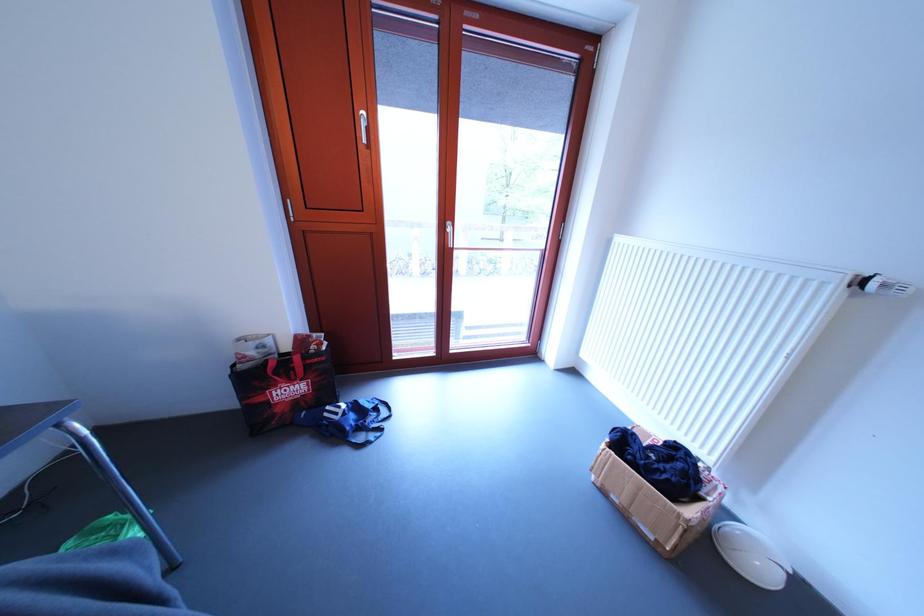
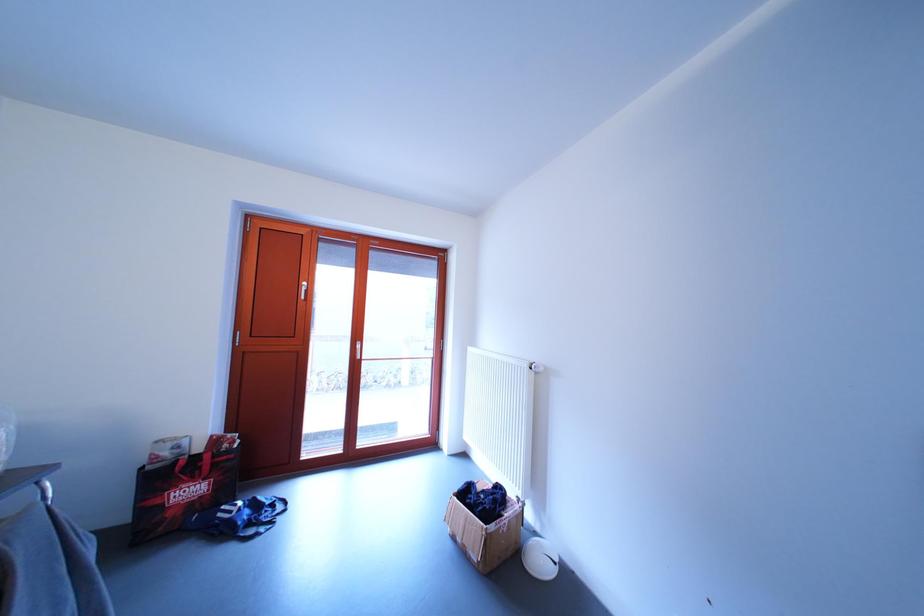
The images are taken continuously from a first-person perspective. In which direction are you moving?

The cameraman moved toward right, backward.